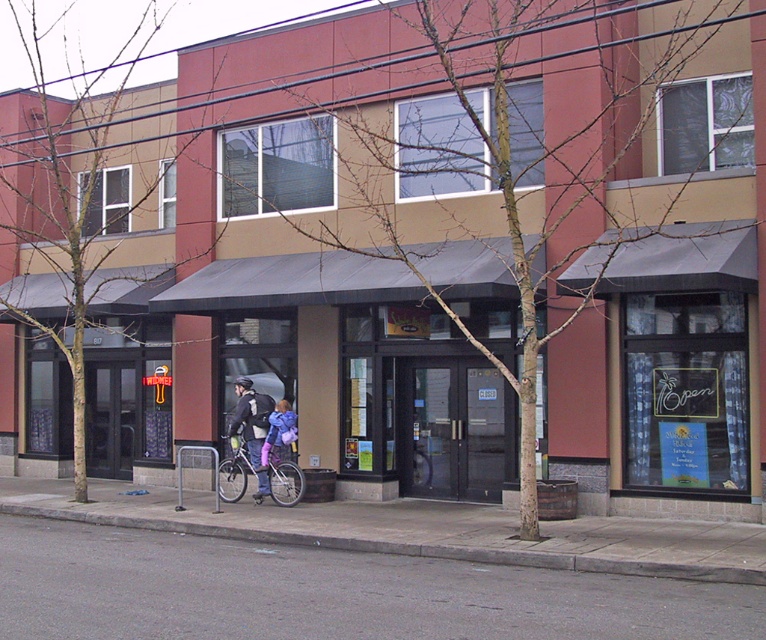
You are a delivery person holding a package that is 10 inches wide. You need to place the package between the matte black jacket at center and the purple fabric bag at center. Is there enough space to fit the package between them?

The distance between the matte black jacket at center and the purple fabric bag at center is 9.83 inches, so the package which is 10 inches wide will not fit between them.

You are standing on the gray concrete pavement at lower center and want to reach the entrance of the building. Is the matte black jacket at center blocking your path?

The gray concrete pavement at lower center is in front of the matte black jacket at center, so the matte black jacket at center is behind you and not blocking your path.

You are standing at the entrance of the building and want to walk to the gray asphalt pavement at lower center. According to the image, in which direction should you move relative to your current position?

The gray asphalt pavement at lower center is located at point (326, 593), so you should move forward and slightly to the right from your current position at the entrance.